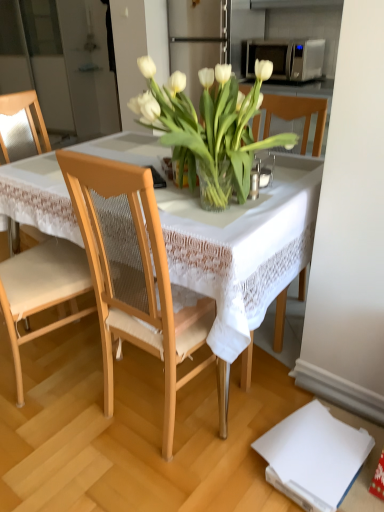
Question: Can you confirm if satin silver microwave at upper right is bigger than light wood mesh chair at left, acting as the 2th chair starting from the front?

Choices:
 (A) yes
 (B) no

Answer: (B)

Question: Is satin silver microwave at upper right looking in the opposite direction of light wood mesh chair at left, marked as the first chair in a back-to-front arrangement?

Choices:
 (A) yes
 (B) no

Answer: (B)

Question: From the image's perspective, would you say satin silver microwave at upper right is shown under light wood mesh chair at left, marked as the first chair in a back-to-front arrangement?

Choices:
 (A) yes
 (B) no

Answer: (B)

Question: Considering the relative sizes of satin silver microwave at upper right and light wood mesh chair at left, marked as the first chair in a back-to-front arrangement, in the image provided, is satin silver microwave at upper right taller than light wood mesh chair at left, marked as the first chair in a back-to-front arrangement,?

Choices:
 (A) yes
 (B) no

Answer: (B)

Question: From a real-world perspective, does satin silver microwave at upper right stand above light wood mesh chair at left, which ranks as the first chair in left-to-right order?

Choices:
 (A) yes
 (B) no

Answer: (A)

Question: Is satin silver microwave at upper right far away from light wood mesh chair at left, acting as the 2th chair starting from the front?

Choices:
 (A) no
 (B) yes

Answer: (B)

Question: Does light wood mesh chair at left, marked as the first chair in a back-to-front arrangement, have a smaller size compared to light wood chair at center, which ranks as the second chair in left-to-right order?

Choices:
 (A) yes
 (B) no

Answer: (B)

Question: Is light wood chair at center, which appears as the second chair when viewed from the back, at the back of light wood mesh chair at left, which is counted as the second chair, starting from the right?

Choices:
 (A) yes
 (B) no

Answer: (B)

Question: Is light wood mesh chair at left, marked as the first chair in a back-to-front arrangement, in front of light wood chair at center, which ranks as the second chair in left-to-right order?

Choices:
 (A) yes
 (B) no

Answer: (B)

Question: Is light wood mesh chair at left, which is counted as the second chair, starting from the right, facing towards light wood chair at center, positioned as the 1th chair in right-to-left order?

Choices:
 (A) yes
 (B) no

Answer: (A)

Question: Does light wood mesh chair at left, which is counted as the second chair, starting from the right, have a greater width compared to light wood chair at center, which appears as the second chair when viewed from the back?

Choices:
 (A) yes
 (B) no

Answer: (A)

Question: Is light wood mesh chair at left, marked as the first chair in a back-to-front arrangement, beside light wood chair at center, which ranks as the second chair in left-to-right order?

Choices:
 (A) yes
 (B) no

Answer: (B)

Question: Can you confirm if satin silver microwave at upper right is thinner than translucent glass vase at center?

Choices:
 (A) no
 (B) yes

Answer: (A)